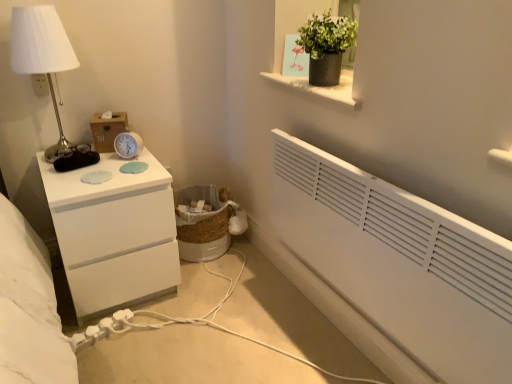
Locate an element on the screen. Image resolution: width=512 pixels, height=384 pixels. free space in front of white plastic extension cord at lower left is located at coordinates (103, 363).